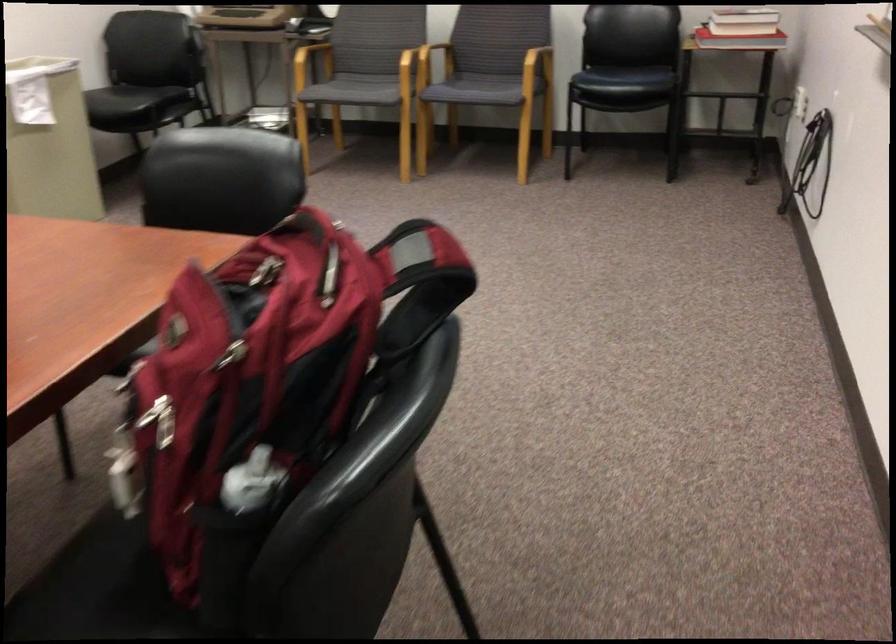
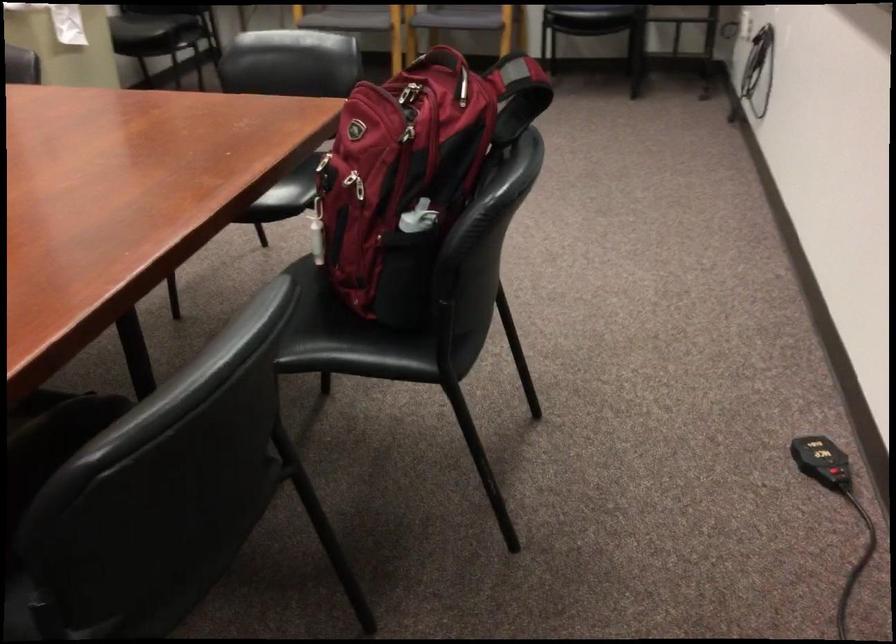
Find the pixel in the second image that matches pixel 247 295 in the first image.

(408, 97)